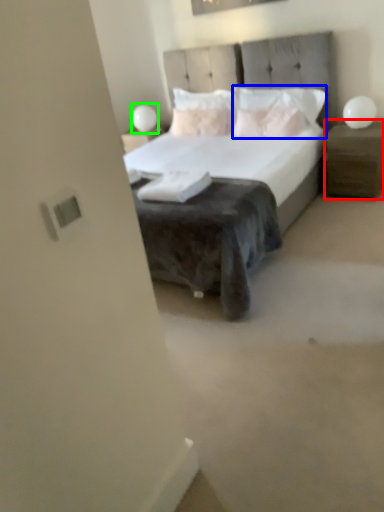
Question: Which is farther away from nightstand (highlighted by a red box)? pillow (highlighted by a blue box) or table lamp (highlighted by a green box)?

Choices:
 (A) pillow
 (B) table lamp

Answer: (B)